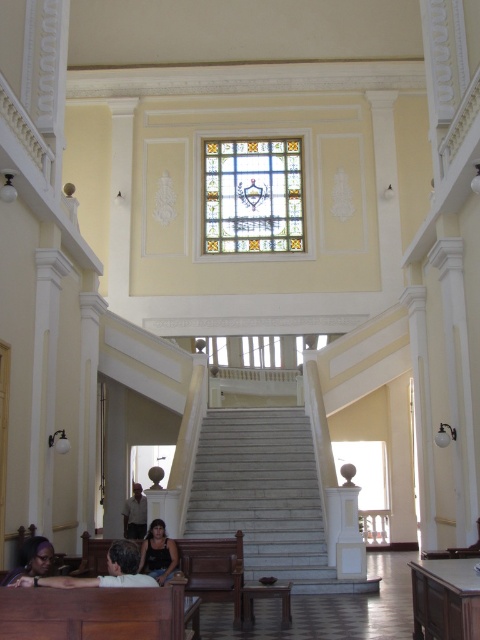
Who is more forward, [188,630] or [41,554]?

Point [188,630] is in front.

Who is more distant from viewer, (147, 589) or (50, 560)?

Point (50, 560)

This screenshot has height=640, width=480. In order to click on wooden polished bench at lower left in this screenshot , I will do `click(97, 612)`.

Is white marble stairs at center bigger than matte black tank top at lower center?

Yes.

Who is taller, white marble stairs at center or matte black tank top at lower center?

white marble stairs at center

Which is in front, point (204, 444) or point (157, 529)?

Point (157, 529)

In order to click on white marble stairs at center in this screenshot , I will do `click(262, 492)`.

Which is behind, point (166, 604) or point (49, 579)?

The point (49, 579) is more distant.

Which is behind, point (84, 602) or point (134, 563)?

Positioned behind is point (134, 563).

Locate an element on the screen. This screenshot has width=480, height=640. wooden polished bench at lower left is located at coordinates (97, 612).